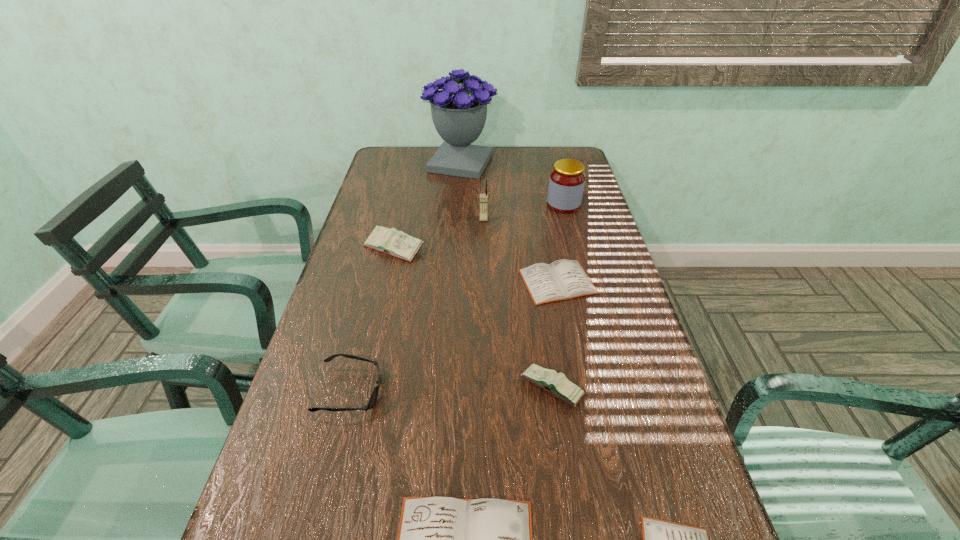
Find the location of `vacant area in the image that satisfies the following two spatial constraints: 1. on the back side of the bouquet; 2. on the right side of the tallest diary`. vacant area in the image that satisfies the following two spatial constraints: 1. on the back side of the bouquet; 2. on the right side of the tallest diary is located at coordinates (414, 163).

In order to click on free space in the image that satisfies the following two spatial constraints: 1. on the back side of the jar; 2. on the left side of the nearer pink diary in this screenshot , I will do `click(526, 205)`.